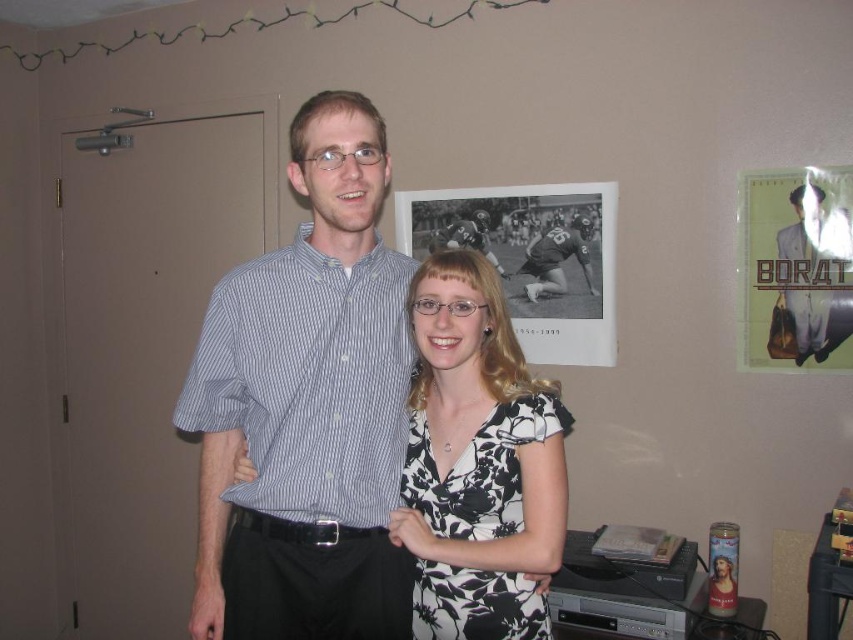
Question: Is light brown fabric suit at center bigger than black leather football player at center?

Choices:
 (A) no
 (B) yes

Answer: (B)

Question: Which object is farther from the camera taking this photo?

Choices:
 (A) striped cotton shirt at center
 (B) black leather football player at center

Answer: (B)

Question: Is black floral dress at center further to the viewer compared to matte black shirt at center?

Choices:
 (A) no
 (B) yes

Answer: (A)

Question: Can you confirm if black floral dress at center is smaller than light brown fabric suit at center?

Choices:
 (A) no
 (B) yes

Answer: (A)

Question: Among these objects, which one is farthest from the camera?

Choices:
 (A) black leather football player at center
 (B) black paper at upper center
 (C) light brown fabric suit at center
 (D) black floral dress at center

Answer: (A)

Question: Which point is farther from the camera taking this photo?

Choices:
 (A) (595, 342)
 (B) (563, 291)
 (C) (357, 218)
 (D) (445, 243)

Answer: (D)